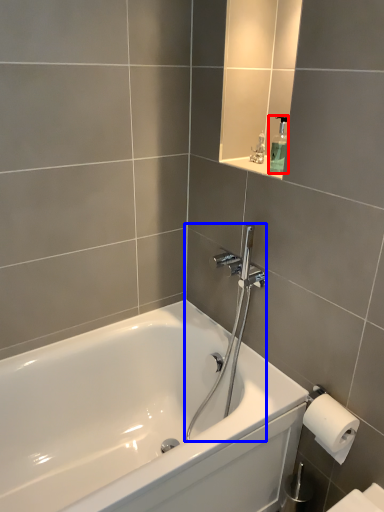
Question: Which point is further to the camera, soap dispenser (highlighted by a red box) or shower (highlighted by a blue box)?

Choices:
 (A) soap dispenser
 (B) shower

Answer: (A)